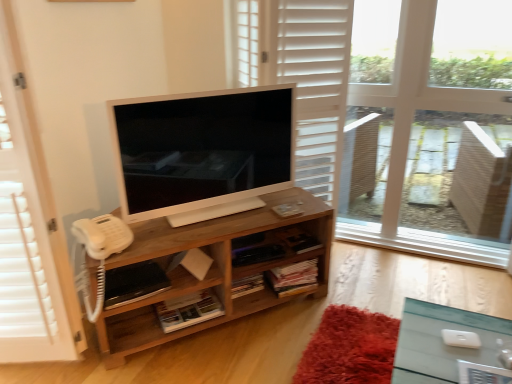
The image size is (512, 384). I want to click on white wood window frame at upper right, so click(434, 127).

At what (x,y) coordinates should I click in order to perform the action: click on white wooden screen door at left. Please return your answer as a coordinate pair (x, y). The height and width of the screenshot is (384, 512). Looking at the image, I should click on (30, 230).

The height and width of the screenshot is (384, 512). What do you see at coordinates (30, 230) in the screenshot?
I see `white wooden screen door at left` at bounding box center [30, 230].

Locate an element on the screen. This screenshot has height=384, width=512. woodenobject at center is located at coordinates (214, 268).

You are a GUI agent. You are given a task and a screenshot of the screen. Output one action in this format:
    pyautogui.click(x=<x>, y=<y>)
    Task: Click on the white wood window frame at upper right
    This screenshot has width=512, height=384.
    Given the screenshot: What is the action you would take?
    pyautogui.click(x=434, y=127)

Between white wooden screen door at left and woodenobject at center, which one appears on the left side from the viewer's perspective?

Positioned to the left is white wooden screen door at left.

I want to click on screen door in front of the woodenobject at center, so click(x=30, y=230).

Measure the distance from white wooden screen door at left to woodenobject at center.

18.19 inches.

Does point (3, 93) appear closer or farther from the camera than point (241, 241)?

Point (3, 93) is closer to the camera than point (241, 241).

Which object is positioned more to the left, white wood window frame at upper right or white wooden screen door at left?

white wooden screen door at left.

Based on the photo, is white wood window frame at upper right turned away from white wooden screen door at left?

A: white wood window frame at upper right does not have its back to white wooden screen door at left.

Considering the points (481, 170) and (0, 10), which point is in front, point (481, 170) or point (0, 10)?

The point (0, 10) is more forward.

At what (x,y) coordinates should I click in order to perform the action: click on screen door that is below the white wood window frame at upper right (from the image's perspective). Please return your answer as a coordinate pair (x, y). This screenshot has width=512, height=384. Looking at the image, I should click on (30, 230).

Can you tell me how much woodenobject at center and white wood window frame at upper right differ in facing direction?

48.1 degrees.

Considering the relative positions of woodenobject at center and white wood window frame at upper right in the image provided, is woodenobject at center to the right of white wood window frame at upper right from the viewer's perspective?

No.

Considering the relative sizes of woodenobject at center and white wood window frame at upper right in the image provided, is woodenobject at center thinner than white wood window frame at upper right?

In fact, woodenobject at center might be wider than white wood window frame at upper right.

Locate an element on the screen. The height and width of the screenshot is (384, 512). shelf that is in front of the white wood window frame at upper right is located at coordinates (214, 268).

Looking at this image, could you tell me if satin white television at center is facing woodenobject at center?

No, satin white television at center does not turn towards woodenobject at center.

From the image's perspective, is satin white television at center above or below woodenobject at center?

Clearly, from the image's perspective, satin white television at center is above woodenobject at center.

Is satin white television at center in contact with woodenobject at center?

They are not placed beside each other.

How different are the orientations of satin white television at center and woodenobject at center in degrees?

The angle between the facing direction of satin white television at center and the facing direction of woodenobject at center is 1.94 degrees.

Looking at this image, from the image's perspective, which is below, white wood window frame at upper right or woodenobject at center?

woodenobject at center is shown below in the image.

Between point (410, 83) and point (247, 296), which one is positioned in front?

The point (247, 296) is in front.

How many degrees apart are the facing directions of white wood window frame at upper right and woodenobject at center?

There is a 48.1-degree angle between the facing directions of white wood window frame at upper right and woodenobject at center.

Is white wood window frame at upper right wider or thinner than woodenobject at center?

In the image, white wood window frame at upper right appears to be more narrow than woodenobject at center.

Which object is wider, white wood window frame at upper right or satin white television at center?

Wider between the two is white wood window frame at upper right.

Is point (411, 218) less distant than point (248, 192)?

No, (411, 218) is further to viewer.

Find the location of a particular element. Image resolution: width=512 pixels, height=384 pixels. television in front of the white wood window frame at upper right is located at coordinates (203, 152).

Is white wood window frame at upper right taller or shorter than satin white television at center?

In the image, white wood window frame at upper right appears to be taller than satin white television at center.

Is satin white television at center at the right side of white wooden screen door at left?

Correct, you'll find satin white television at center to the right of white wooden screen door at left.

Can white wooden screen door at left be found inside satin white television at center?

Definitely not — white wooden screen door at left is not inside satin white television at center.

Is satin white television at center not close to white wooden screen door at left?

That's not correct — satin white television at center is a little close to white wooden screen door at left.

Consider the image. Does satin white television at center come in front of white wooden screen door at left?

No, the depth of satin white television at center is greater than that of white wooden screen door at left.

Locate an element on the screen. The height and width of the screenshot is (384, 512). shelf below the white wooden screen door at left (from a real-world perspective) is located at coordinates (214, 268).

I want to click on screen door on the left of white wood window frame at upper right, so click(30, 230).

Which object lies further to the anchor point woodenobject at center, white wooden screen door at left or satin white television at center?

Based on the image, white wooden screen door at left appears to be further to woodenobject at center.

When comparing their distances from white wood window frame at upper right, does satin white television at center or woodenobject at center seem further?

Among the two, woodenobject at center is located further to white wood window frame at upper right.

Considering their positions, is satin white television at center positioned further to woodenobject at center than white wooden screen door at left?

white wooden screen door at left lies further to woodenobject at center than the other object.

When comparing their distances from woodenobject at center, does white wood window frame at upper right or white wooden screen door at left seem further?

Based on the image, white wood window frame at upper right appears to be further to woodenobject at center.

Which object lies nearer to the anchor point satin white television at center, white wood window frame at upper right or woodenobject at center?

Among the two, woodenobject at center is located nearer to satin white television at center.

Considering their positions, is satin white television at center positioned closer to white wooden screen door at left than white wood window frame at upper right?

satin white television at center is positioned closer to the anchor white wooden screen door at left.

Considering their positions, is satin white television at center positioned further to white wooden screen door at left than woodenobject at center?

satin white television at center is positioned further to the anchor white wooden screen door at left.

In the scene shown: Which object lies nearer to the anchor point white wooden screen door at left, woodenobject at center or satin white television at center?

woodenobject at center is positioned closer to the anchor white wooden screen door at left.

Find the location of a particular element. television between white wooden screen door at left and white wood window frame at upper right is located at coordinates (203, 152).

Locate an element on the screen. The height and width of the screenshot is (384, 512). shelf between white wooden screen door at left and white wood window frame at upper right in the horizontal direction is located at coordinates point(214,268).

Identify the location of television between woodenobject at center and white wood window frame at upper right from left to right. Image resolution: width=512 pixels, height=384 pixels. (203, 152).

In order to click on shelf located between white wooden screen door at left and satin white television at center in the left-right direction in this screenshot , I will do `click(214, 268)`.